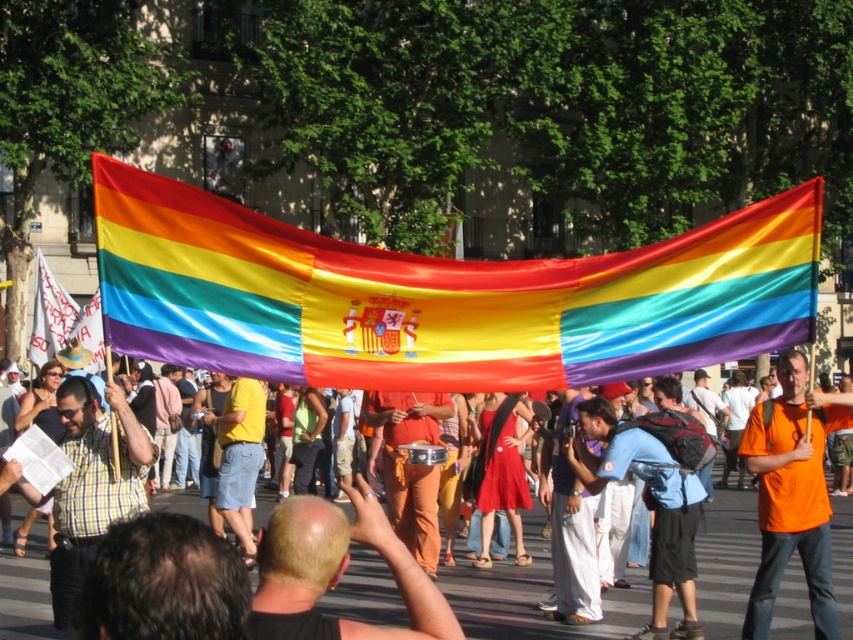
Can you confirm if silky rainbow flag at center is bigger than rainbow fabric flag at upper center?

Actually, silky rainbow flag at center might be smaller than rainbow fabric flag at upper center.

Can you confirm if silky rainbow flag at center is positioned above rainbow fabric flag at upper center?

Yes, silky rainbow flag at center is above rainbow fabric flag at upper center.

At what (x,y) coordinates should I click in order to perform the action: click on silky rainbow flag at center. Please return your answer as a coordinate pair (x, y). Looking at the image, I should click on (439, 296).

Measure the distance between point (x=610, y=620) and camera.

Point (x=610, y=620) is 15.56 meters from camera.

Is orange cotton shirt at center below checkered fabric shirt at center?

Correct, orange cotton shirt at center is located below checkered fabric shirt at center.

Where is `orange cotton shirt at center`? The width and height of the screenshot is (853, 640). orange cotton shirt at center is located at coordinates (532, 598).

The height and width of the screenshot is (640, 853). I want to click on orange cotton shirt at center, so click(532, 598).

Does silky rainbow flag at center have a smaller size compared to orange cotton shirt at center?

Indeed, silky rainbow flag at center has a smaller size compared to orange cotton shirt at center.

Who is more forward, (282, 268) or (779, 621)?

Point (282, 268)

I want to click on silky rainbow flag at center, so click(x=439, y=296).